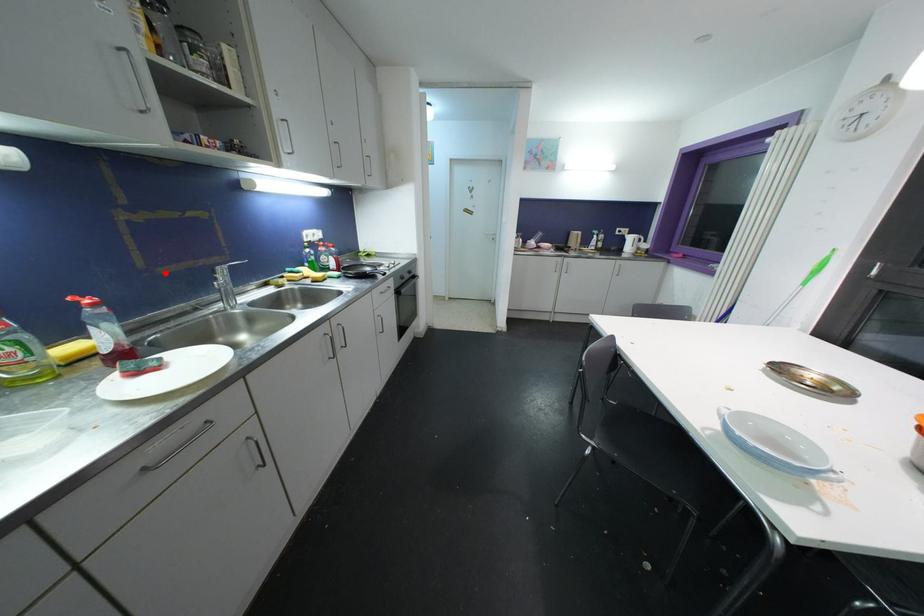
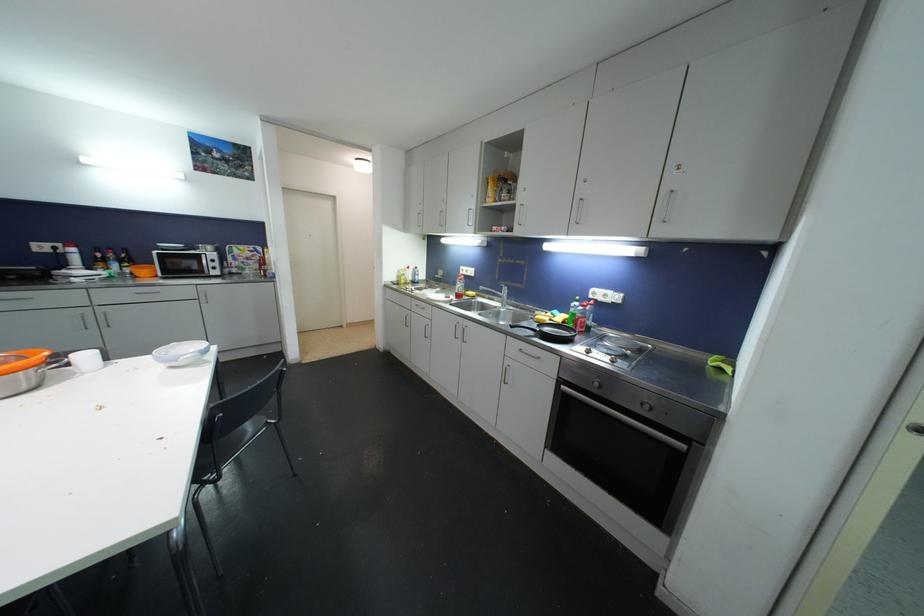
Question: I am providing you with two images of the same scene from different viewpoints. A red point is marked on the first image. Can you still see the location of the red point in image 2?

Choices:
 (A) Yes
 (B) No

Answer: (A)